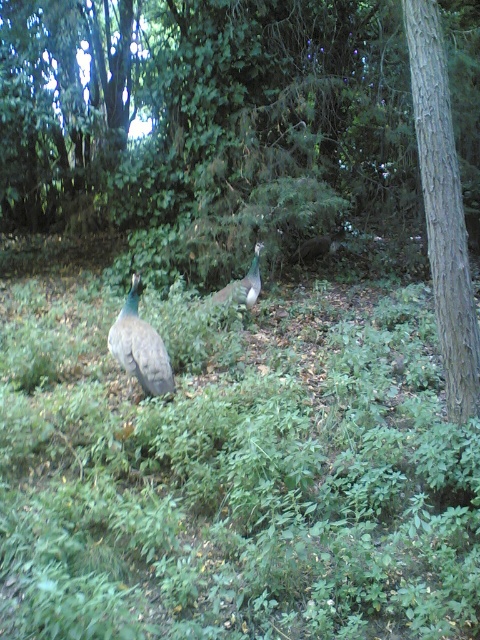
You are a bird looking for a place to land. You see the green leafy grass at center and the brown textured tree at center right. Which one is closer to the ground?

The green leafy grass at center is located below brown textured tree at center right, so it is closer to the ground.